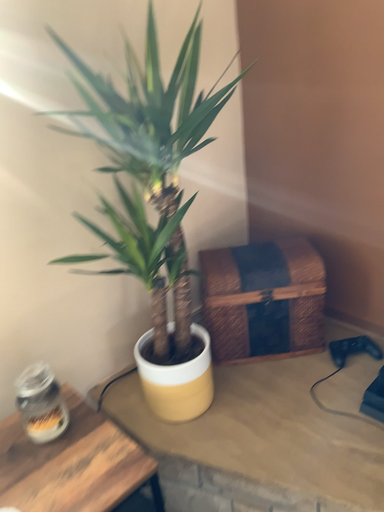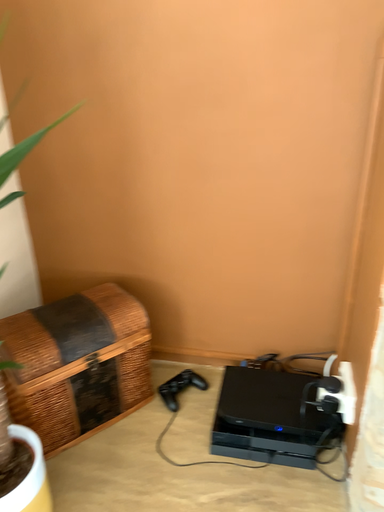
Question: How did the camera likely rotate when shooting the video?

Choices:
 (A) rotated right
 (B) rotated left

Answer: (A)